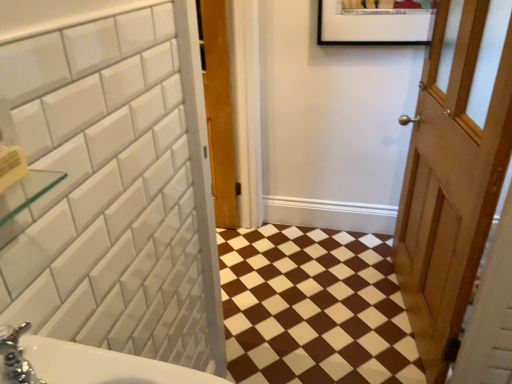
You are a GUI agent. You are given a task and a screenshot of the screen. Output one action in this format:
    pyautogui.click(x=<x>, y=<y>)
    Task: Click on the unoccupied area behind wooden door at right
    The width and height of the screenshot is (512, 384).
    Given the screenshot: What is the action you would take?
    pyautogui.click(x=355, y=259)